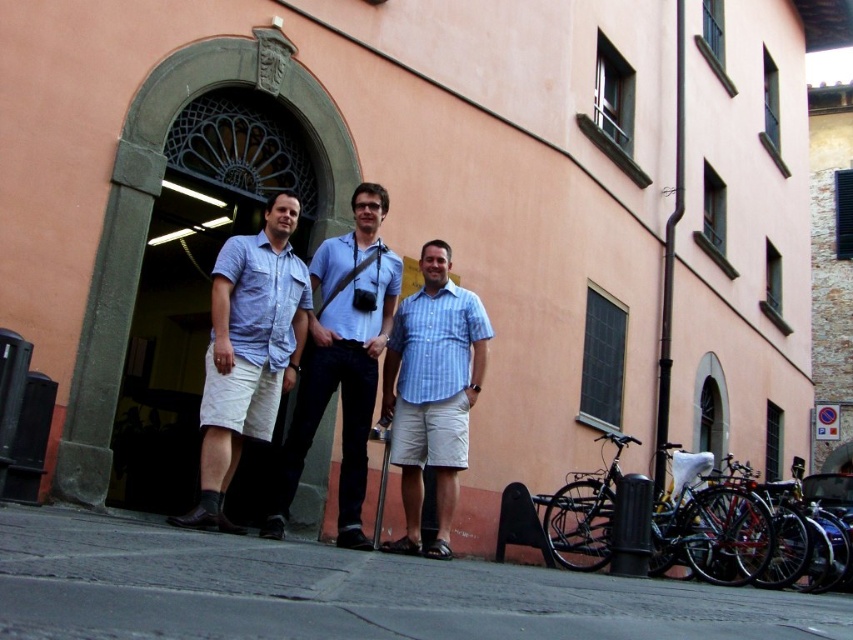
Question: In this image, where is blue denim shirt at center located relative to shiny metallic bicycle at lower right?

Choices:
 (A) above
 (B) below

Answer: (A)

Question: Which point appears farthest from the camera in this image?

Choices:
 (A) (282, 278)
 (B) (664, 380)
 (C) (85, 540)

Answer: (B)

Question: Can you confirm if gray concrete pavement at lower center is thinner than black metal pole at right?

Choices:
 (A) no
 (B) yes

Answer: (B)

Question: Which point appears farthest from the camera in this image?

Choices:
 (A) (663, 472)
 (B) (357, 403)
 (C) (347, 586)

Answer: (A)

Question: Can you confirm if light blue shirt at center is smaller than blue striped shirt at center?

Choices:
 (A) no
 (B) yes

Answer: (A)

Question: Which point is closer to the camera?

Choices:
 (A) (688, 541)
 (B) (352, 292)
 (C) (480, 611)

Answer: (C)